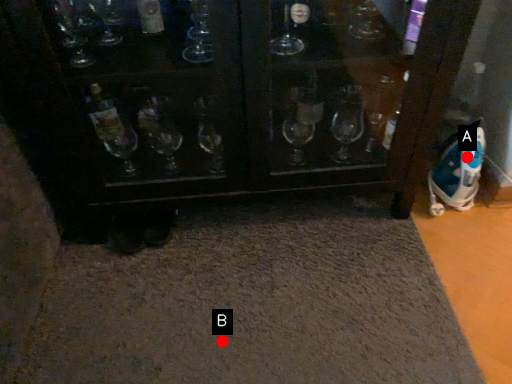
Question: Two points are circled on the image, labeled by A and B beside each circle. Which point is closer to the camera?

Choices:
 (A) A is closer
 (B) B is closer

Answer: (B)